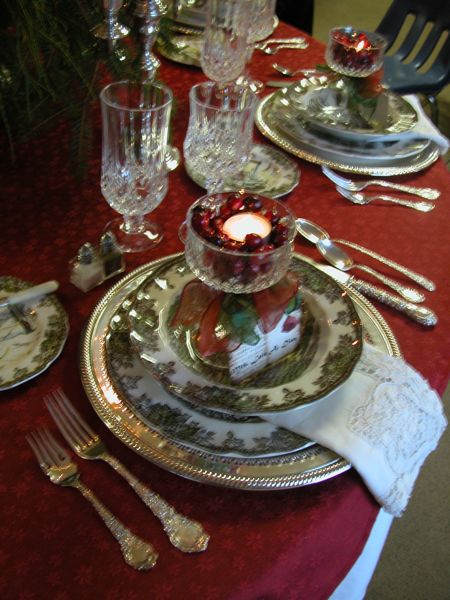
Find the location of a particular element. The image size is (450, 600). candle is located at coordinates (240, 229), (358, 43).